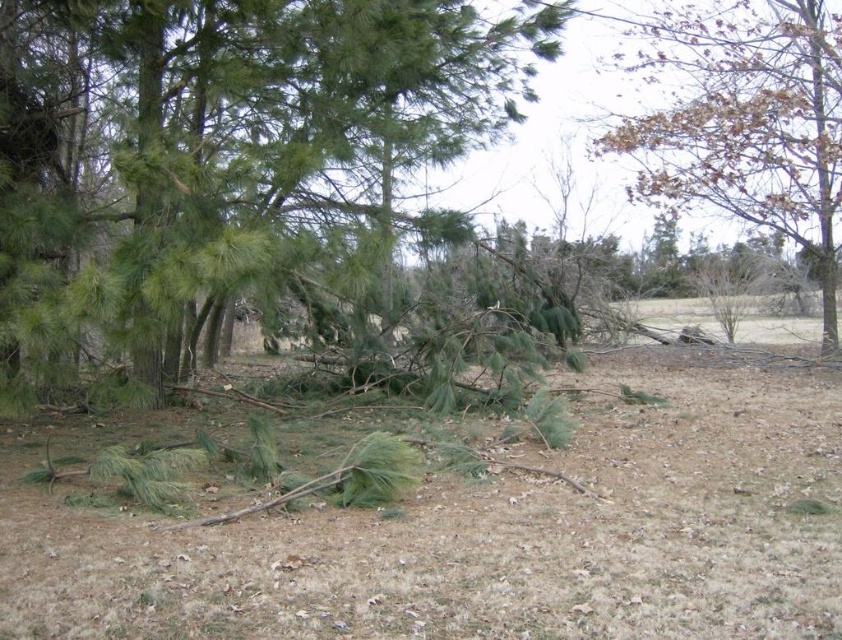
Question: Is green needle-like at center further to camera compared to brown leafy tree at upper right?

Choices:
 (A) no
 (B) yes

Answer: (A)

Question: Is green needle-like at center behind brown leafy tree at upper right?

Choices:
 (A) yes
 (B) no

Answer: (B)

Question: Which of the following is the closest to the observer?

Choices:
 (A) (825, 202)
 (B) (302, 99)

Answer: (B)

Question: Can you confirm if brown dry grass at center is wider than brown leafy tree at upper right?

Choices:
 (A) yes
 (B) no

Answer: (A)

Question: Which point appears farthest from the camera in this image?

Choices:
 (A) (797, 72)
 (B) (113, 168)
 (C) (592, 524)

Answer: (A)

Question: Which of the following is the closest to the observer?

Choices:
 (A) (809, 620)
 (B) (148, 136)

Answer: (A)